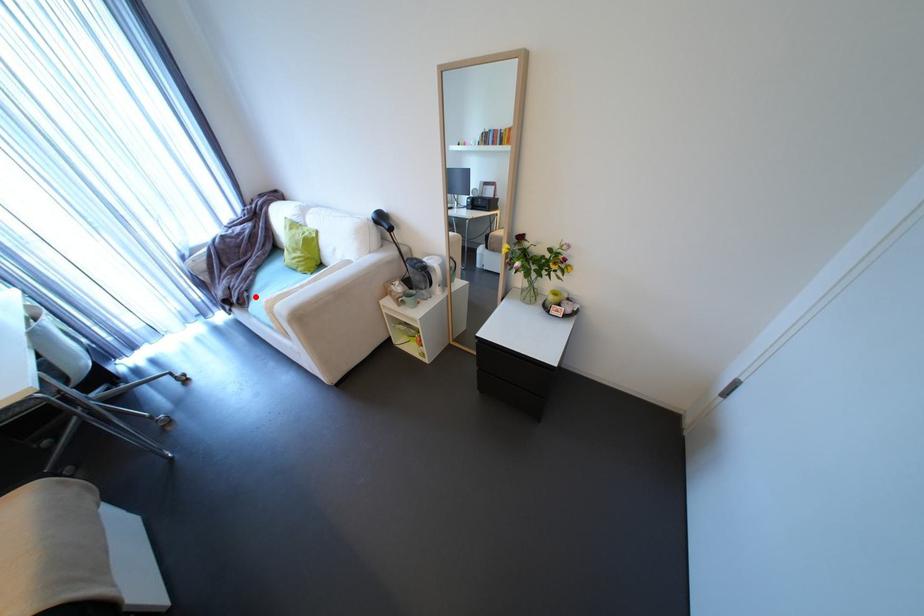
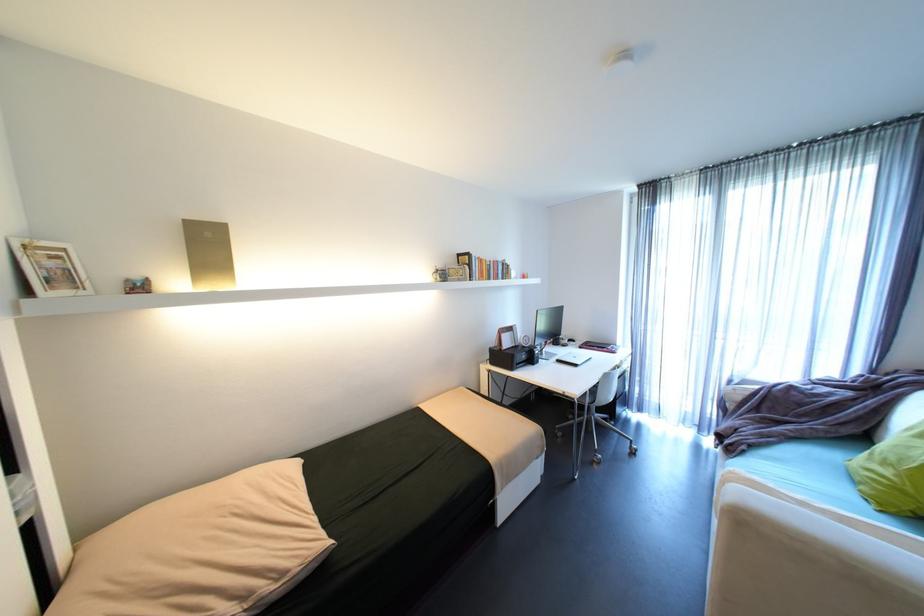
Question: I am providing you with two images of the same scene from different viewpoints. In image1, a red point is highlighted. Considering the same 3D point in image2, which of the following is correct?

Choices:
 (A) It is closer
 (B) It is farther

Answer: (A)